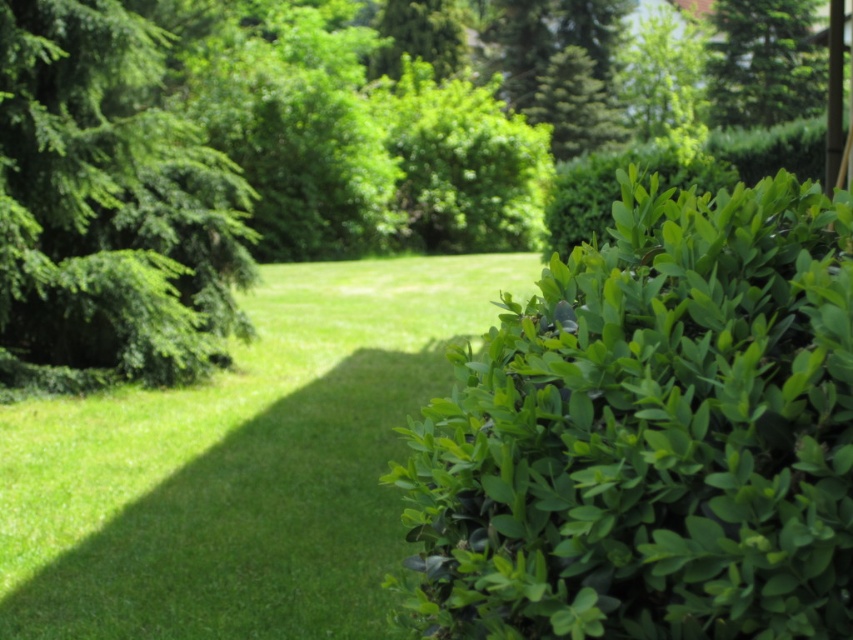
What do you see at coordinates (108, 208) in the screenshot? This screenshot has width=853, height=640. I see `green leafy tree at left` at bounding box center [108, 208].

Consider the image. Which is more to the left, green leafy tree at left or green leafy bush at center?

From the viewer's perspective, green leafy tree at left appears more on the left side.

Where is `green leafy tree at left`? This screenshot has height=640, width=853. green leafy tree at left is located at coordinates (108, 208).

Which is above, green leafy bush at right or green leafy bush at center?

green leafy bush at center is higher up.

At what (x,y) coordinates should I click in order to perform the action: click on green leafy bush at right. Please return your answer as a coordinate pair (x, y). This screenshot has height=640, width=853. Looking at the image, I should click on (653, 433).

Who is more distant from viewer, (x=358, y=564) or (x=532, y=168)?

Point (x=532, y=168)

What do you see at coordinates (241, 467) in the screenshot? The image size is (853, 640). I see `green leafy grass at center` at bounding box center [241, 467].

What do you see at coordinates (241, 467) in the screenshot? I see `green leafy grass at center` at bounding box center [241, 467].

This screenshot has height=640, width=853. Identify the location of green leafy grass at center. (241, 467).